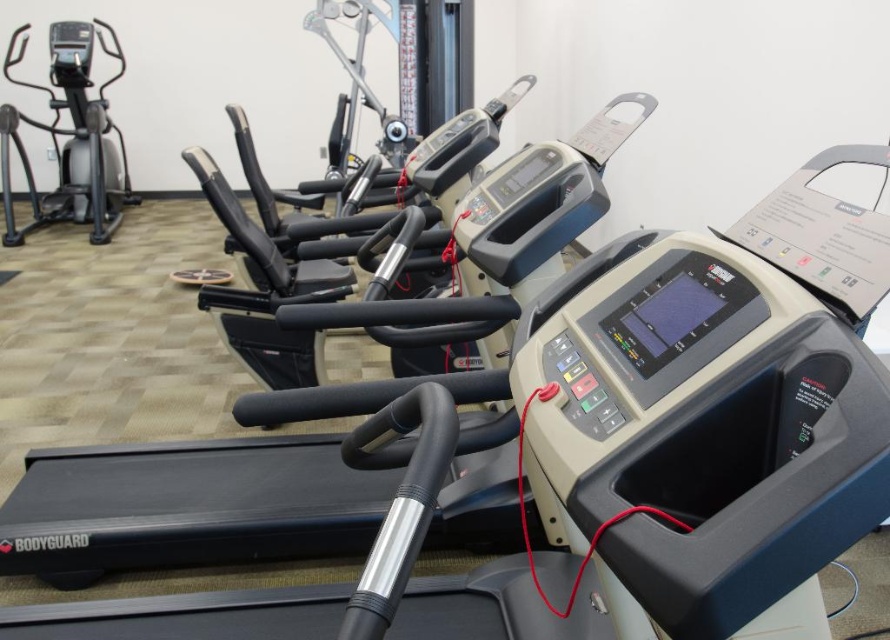
You are standing in a gym and want to use the treadmill. The black plastic treadmill at center is the one you want to use. If you are currently 3 feet away from it, can you reach the red cable draped over its handlebars without moving closer?

The distance of black plastic treadmill at center from viewer is 33.09 inches. Since 3 feet equals 36 inches, you are slightly farther away than the treadmill. Therefore, you would need to move closer to reach the red cable draped over its handlebars.

You are a fitness instructor planning to place a new water dispenser in the gym. The dispenser requires a space of 1 meter in front to avoid blocking the treadmills. Given the position of the black plastic treadmill at center, can you confirm if placing the dispenser at point A, which is 1.2 meters away from the treadmill, would be safe?

The black plastic treadmill at center is located at point A, which is 1.2 meters away from the treadmill. Since the dispenser requires 1 meter of space, placing it at 1.2 meters is safe as it exceeds the required distance.

You are a gym member trying to locate the elliptical trainer for your workout. You see the black plastic treadmill at center and the silver metallic elliptical trainer at left. Which one is located to the left of the other?

The silver metallic elliptical trainer at left is located to the left of the black plastic treadmill at center.